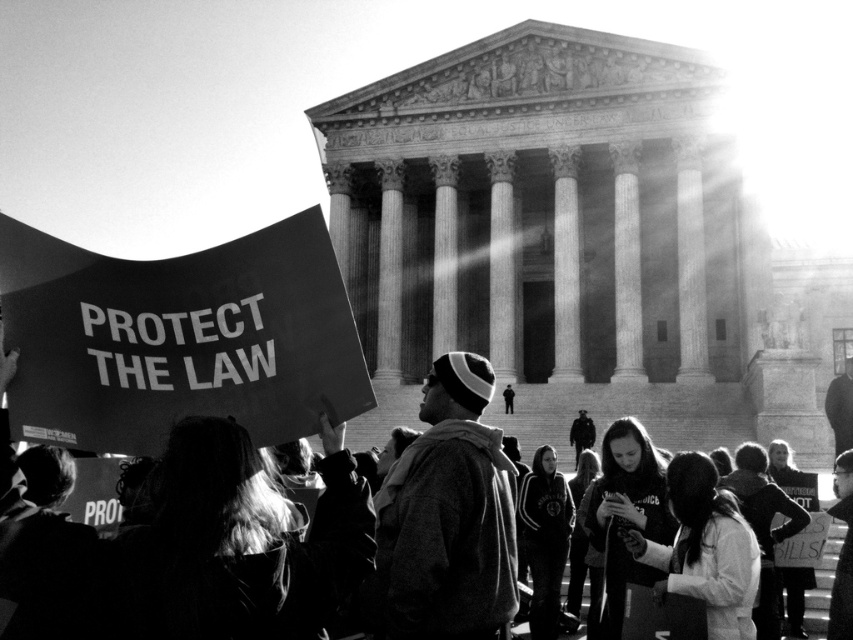
You are a photographer at the protest scene. You need to capture a closeup of the knit cap at center and the black cardboard sign at lower left in one frame. Which object should you zoom in on first to ensure both fit in the frame?

You should zoom in on the knit cap at center first because it has a smaller width than the black cardboard sign at lower left, allowing more room to adjust the frame to include both objects.

You are a photographer trying to capture a clear shot of the knit cap at center and the black cardboard sign at lower left. Based on their sizes in the image, which object would require you to move closer to ensure it is adequately framed?

The knit cap at center has a smaller size compared to the black cardboard sign at lower left, so you would need to move closer to the knit cap at center to ensure it is adequately framed.

You are a photographer trying to capture a clear shot of the knit cap at center and the black cardboard sign at lower left. Based on their positions, which object is closer to the camera?

The knit cap at center is positioned under the black cardboard sign at lower left, meaning it is closer to the camera than the sign.